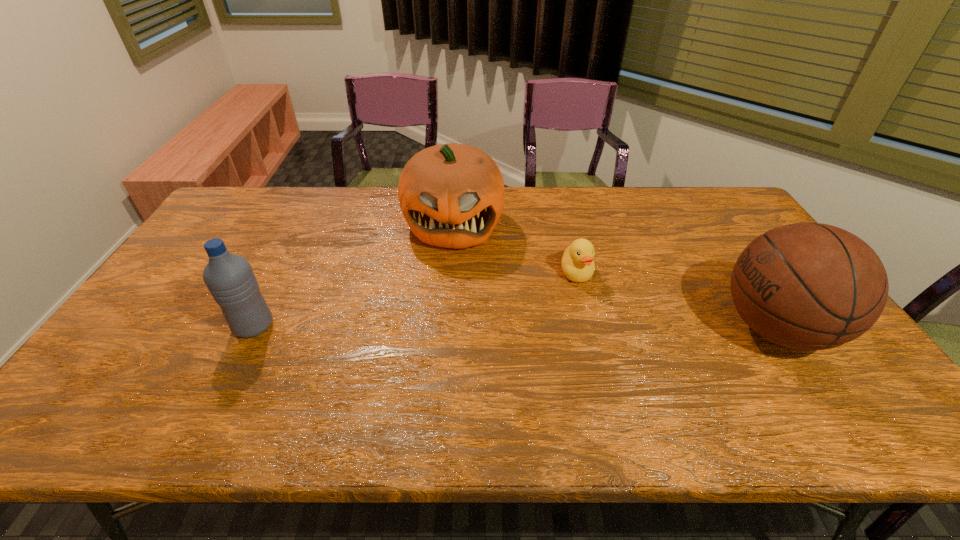
Where is `vacant space on the desktop that is between the leftmost object and the rightmost object and is positioned on the face of the duckling`? Image resolution: width=960 pixels, height=540 pixels. vacant space on the desktop that is between the leftmost object and the rightmost object and is positioned on the face of the duckling is located at coordinates (587, 327).

Find the location of a particular element. vacant space on the desktop that is between the leftmost object and the rightmost object and is positioned on the face of the pumpkin is located at coordinates (445, 327).